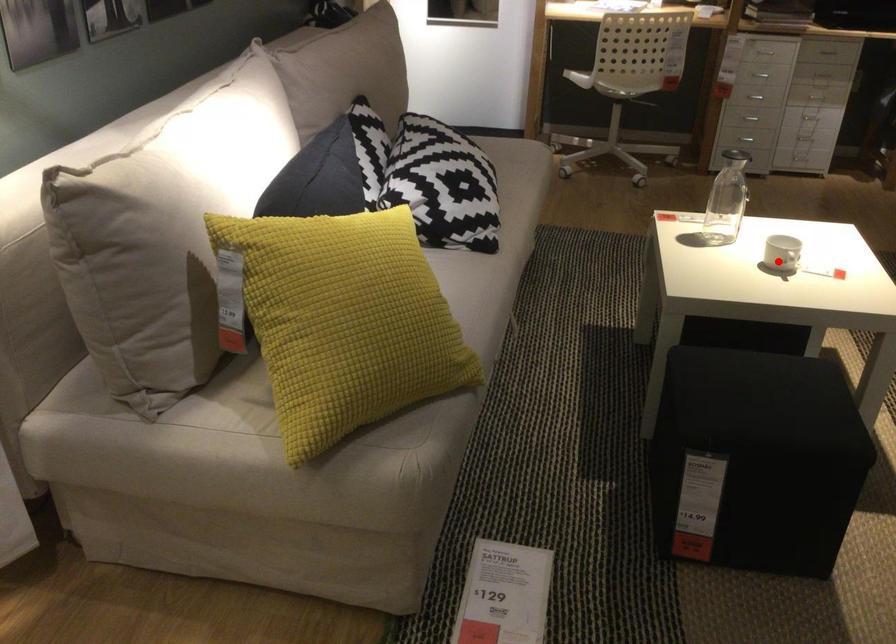
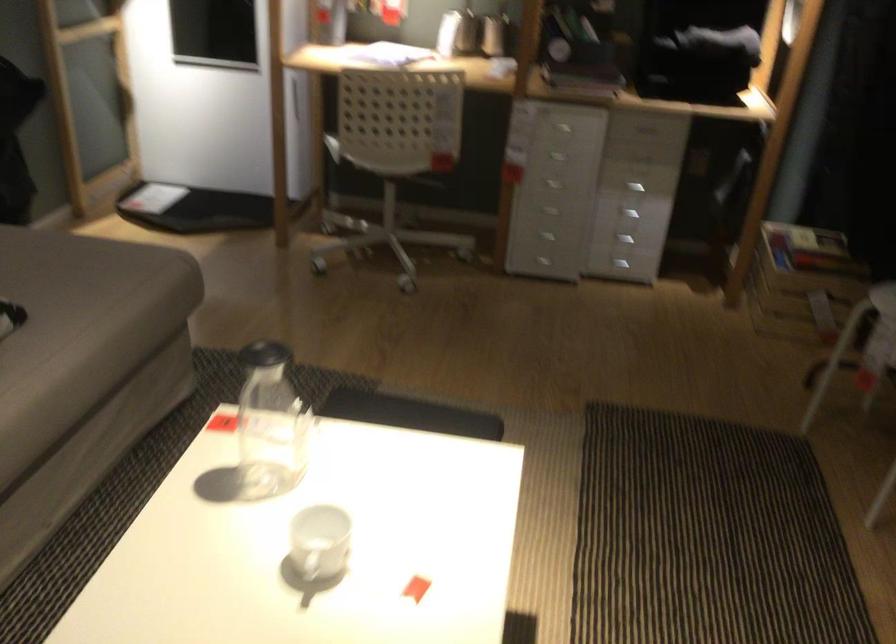
Question: I am providing you with two images of the same scene from different viewpoints. Given a red point in image1, look at the same physical point in image2. Is it:

Choices:
 (A) Closer to the viewpoint
 (B) Farther from the viewpoint

Answer: (A)